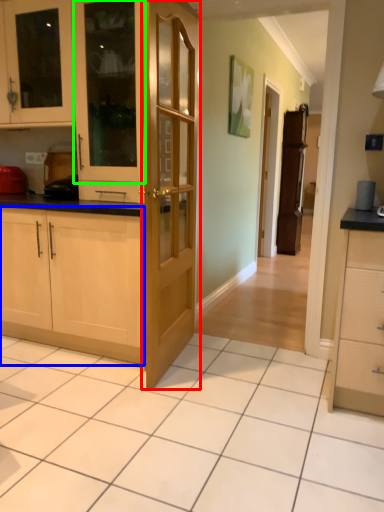
Question: Estimate the real-world distances between objects in this image. Which object is farther from door (highlighted by a red box), cabinetry (highlighted by a blue box) or cabinetry (highlighted by a green box)?

Choices:
 (A) cabinetry
 (B) cabinetry

Answer: (A)